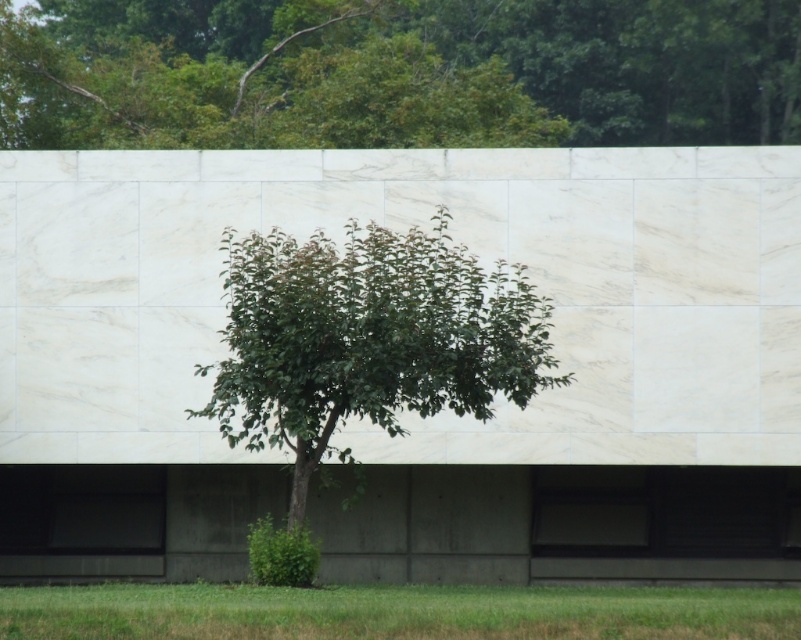
Looking at this image, is green leafy tree at upper center closer to camera compared to green grass at lower center?

No, it is not.

Who is positioned more to the right, green leafy tree at upper center or green grass at lower center?

green grass at lower center is more to the right.

Is point (329, 4) farther from viewer compared to point (377, 600)?

That is True.

The image size is (801, 640). In order to click on green leafy tree at upper center in this screenshot , I will do `click(397, 72)`.

Is point (492, 168) closer to camera compared to point (351, 365)?

No, (492, 168) is further to viewer.

Is white marble wall at center above green leafy tree at center?

Yes.

Who is more distant from viewer, (795, 340) or (284, 362)?

The point (795, 340) is more distant.

Locate an element on the screen. The height and width of the screenshot is (640, 801). white marble wall at center is located at coordinates coord(405,228).

This screenshot has width=801, height=640. Describe the element at coordinates (367, 339) in the screenshot. I see `green leafy tree at center` at that location.

Is green leafy tree at center to the right of green grass at lower center from the viewer's perspective?

Incorrect, green leafy tree at center is not on the right side of green grass at lower center.

Is point (341, 308) farther from camera compared to point (327, 624)?

That is True.

Where is `green leafy tree at center`? green leafy tree at center is located at coordinates (367, 339).